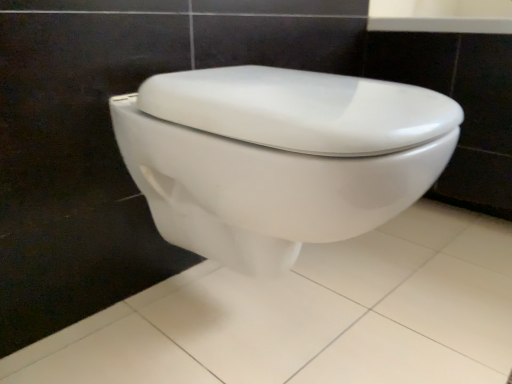
Question: From a real-world perspective, is white glossy toilet at center positioned above or below white glossy toilet at center?

Choices:
 (A) below
 (B) above

Answer: (A)

Question: Is white glossy toilet at center taller or shorter than white glossy toilet at center?

Choices:
 (A) tall
 (B) short

Answer: (B)

Question: In the image, is white glossy toilet at center positioned in front of or behind white glossy toilet at center?

Choices:
 (A) front
 (B) behind

Answer: (A)

Question: Is point (333, 198) positioned closer to the camera than point (201, 319)?

Choices:
 (A) closer
 (B) farther

Answer: (A)

Question: Based on their sizes in the image, would you say white glossy toilet at center is bigger or smaller than white glossy toilet at center?

Choices:
 (A) big
 (B) small

Answer: (A)

Question: Do you think white glossy toilet at center is within white glossy toilet at center, or outside of it?

Choices:
 (A) outside
 (B) inside

Answer: (A)

Question: Is white glossy toilet at center to the left or to the right of white glossy toilet at center in the image?

Choices:
 (A) right
 (B) left

Answer: (B)